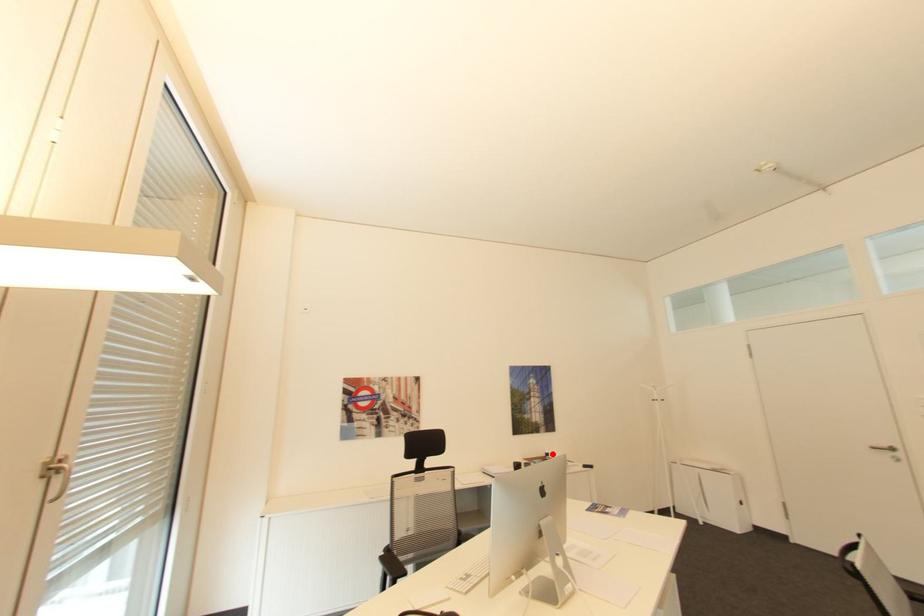
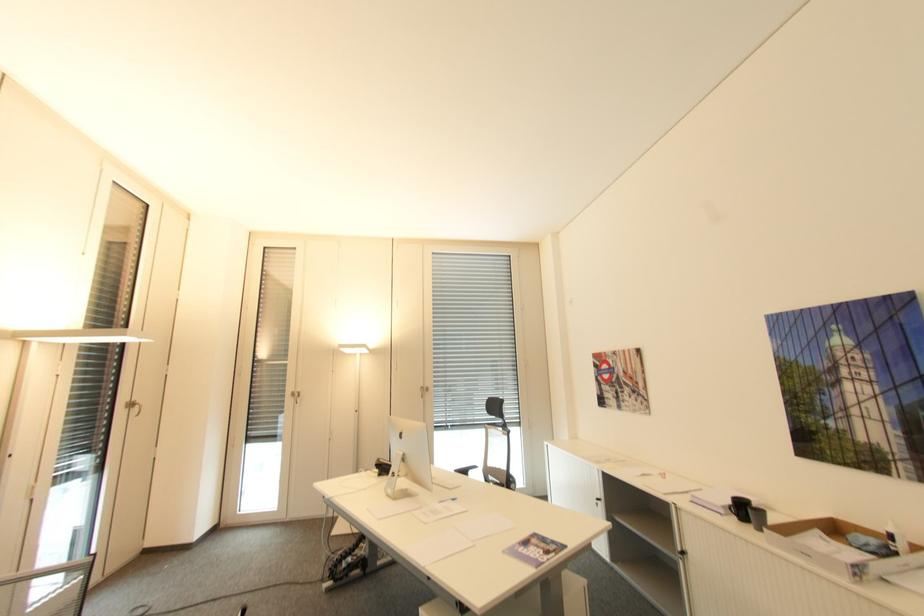
Question: I am providing you with two images of the same scene from different viewpoints. A red point is shown in image1. For the corresponding object point in image2, is it positioned nearer or farther from the camera?

Choices:
 (A) Nearer
 (B) Farther

Answer: (A)